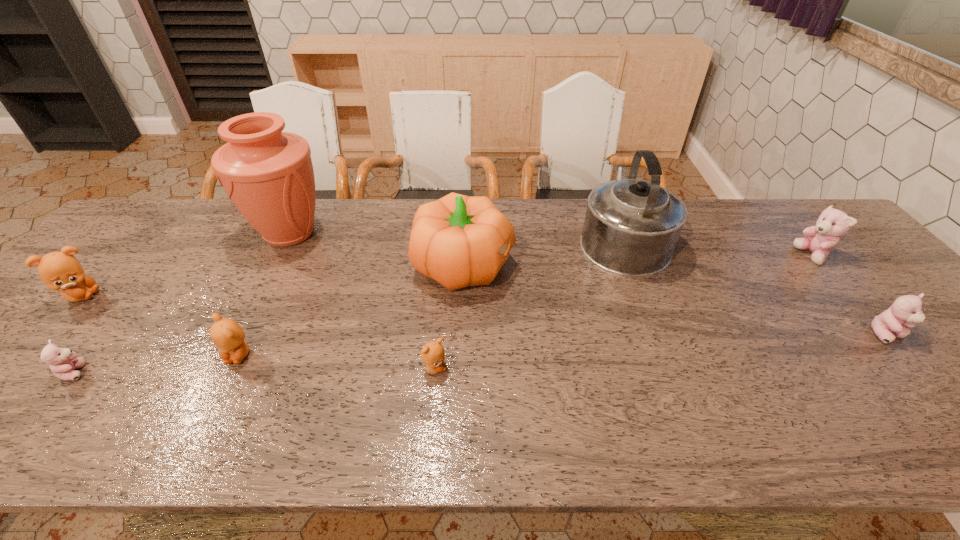
Where is `free spot located at the face of the farthest pink teddy bear`? The width and height of the screenshot is (960, 540). free spot located at the face of the farthest pink teddy bear is located at coordinates (731, 255).

This screenshot has height=540, width=960. I want to click on vacant region located on the face of the biggest brown teddy bear, so click(x=132, y=296).

This screenshot has height=540, width=960. I want to click on free space located 0.170m on the face of the second biggest brown teddy bear, so click(x=197, y=440).

Find the location of `vacant space located 0.120m at the face of the second farthest pink teddy bear`. vacant space located 0.120m at the face of the second farthest pink teddy bear is located at coordinates (936, 392).

Identify the location of vacant space situated on the face of the smallest brown teddy bear. This screenshot has height=540, width=960. (554, 369).

At what (x,y) coordinates should I click in order to perform the action: click on free space located at the face of the nearest pink teddy bear. Please return your answer as a coordinate pair (x, y). Image resolution: width=960 pixels, height=540 pixels. Looking at the image, I should click on (260, 372).

Image resolution: width=960 pixels, height=540 pixels. Identify the location of vase positioned at the far edge. (268, 174).

This screenshot has width=960, height=540. I want to click on kettle that is positioned at the far edge, so click(x=631, y=227).

Where is `pumpkin that is at the far edge`? pumpkin that is at the far edge is located at coordinates (458, 241).

Image resolution: width=960 pixels, height=540 pixels. In order to click on teddy bear that is at the far edge in this screenshot , I will do `click(832, 223)`.